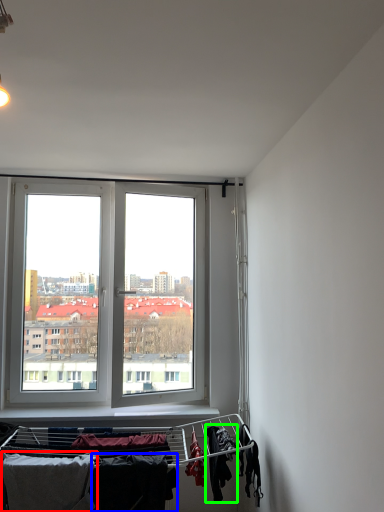
Question: Which object is the farthest from clothing (highlighted by a red box)? Choose among these: clothing (highlighted by a blue box) or clothing (highlighted by a green box).

Choices:
 (A) clothing
 (B) clothing

Answer: (B)